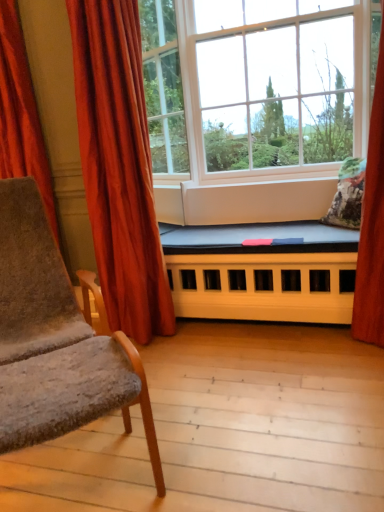
Question: Is fluffy floral pillow at right looking in the opposite direction of velvet red curtain at left, which is counted as the 1th curtain, starting from the left?

Choices:
 (A) yes
 (B) no

Answer: (B)

Question: Is fluffy floral pillow at right bigger than velvet red curtain at left, which is counted as the 1th curtain, starting from the left?

Choices:
 (A) no
 (B) yes

Answer: (A)

Question: Can you confirm if fluffy floral pillow at right is wider than velvet red curtain at left, placed as the 2th curtain when sorted from right to left?

Choices:
 (A) no
 (B) yes

Answer: (B)

Question: From a real-world perspective, is fluffy floral pillow at right positioned over velvet red curtain at left, placed as the 2th curtain when sorted from right to left, based on gravity?

Choices:
 (A) no
 (B) yes

Answer: (A)

Question: Considering the relative positions of fluffy floral pillow at right and velvet red curtain at left, placed as the 2th curtain when sorted from right to left, in the image provided, is fluffy floral pillow at right in front of velvet red curtain at left, placed as the 2th curtain when sorted from right to left,?

Choices:
 (A) yes
 (B) no

Answer: (B)

Question: From a real-world perspective, is fluffy floral pillow at right below velvet red curtain at left, which is counted as the 1th curtain, starting from the left?

Choices:
 (A) yes
 (B) no

Answer: (A)

Question: Are velvet red curtain at left, which is counted as the first curtain, starting from the right, and black fabric bed at center far apart?

Choices:
 (A) yes
 (B) no

Answer: (B)

Question: Does velvet red curtain at left, which is counted as the first curtain, starting from the right, have a greater width compared to black fabric bed at center?

Choices:
 (A) no
 (B) yes

Answer: (A)

Question: Considering the relative sizes of velvet red curtain at left, the second curtain in the left-to-right sequence, and black fabric bed at center in the image provided, is velvet red curtain at left, the second curtain in the left-to-right sequence, taller than black fabric bed at center?

Choices:
 (A) yes
 (B) no

Answer: (A)

Question: Does velvet red curtain at left, the second curtain in the left-to-right sequence, have a smaller size compared to black fabric bed at center?

Choices:
 (A) yes
 (B) no

Answer: (B)

Question: Does velvet red curtain at left, which is counted as the first curtain, starting from the right, appear on the right side of black fabric bed at center?

Choices:
 (A) yes
 (B) no

Answer: (B)

Question: From a real-world perspective, is velvet red curtain at left, the second curtain in the left-to-right sequence, located beneath black fabric bed at center?

Choices:
 (A) no
 (B) yes

Answer: (A)

Question: Is white plastic window at center, the second window in the left-to-right sequence, touching velvet gray armchair at left?

Choices:
 (A) no
 (B) yes

Answer: (A)